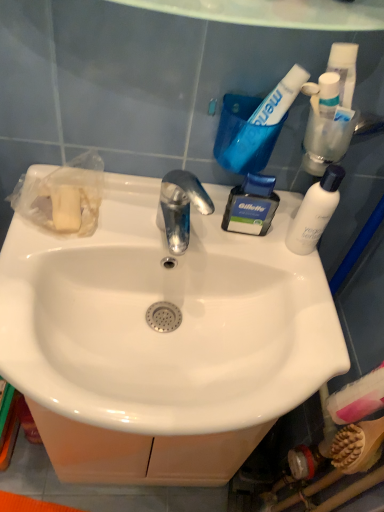
This screenshot has width=384, height=512. I want to click on blue plastic shaving cream at upper right, arranged as the 2th toiletry when ordered from the bottom, so click(251, 206).

The width and height of the screenshot is (384, 512). What are the coordinates of `clear plastic tube at upper right, placed as the first toiletry when sorted from top to bottom` in the screenshot? It's located at (325, 125).

Locate an element on the screen. white matte bottle at upper right is located at coordinates (315, 212).

In the scene shown: From the image's perspective, which is below, clear plastic tube at upper right, placed as the first toiletry when sorted from top to bottom, or white glossy sink at center?

From the image's view, white glossy sink at center is below.

Is clear plastic tube at upper right, placed as the first toiletry when sorted from top to bottom, facing towards white glossy sink at center?

No.

Who is shorter, clear plastic tube at upper right, which is the third toiletry in bottom-to-top order, or white glossy sink at center?

clear plastic tube at upper right, which is the third toiletry in bottom-to-top order.

Considering the relative positions of wooden bristles brush at lower right and blue plastic shaving cream at upper right, which is the third toiletry from right to left, in the image provided, is wooden bristles brush at lower right to the right of blue plastic shaving cream at upper right, which is the third toiletry from right to left, from the viewer's perspective?

Yes, wooden bristles brush at lower right is to the right of blue plastic shaving cream at upper right, which is the third toiletry from right to left.

You are a GUI agent. You are given a task and a screenshot of the screen. Output one action in this format:
    pyautogui.click(x=<x>, y=<y>)
    Task: Click on the brush that is under the blue plastic shaving cream at upper right, the first toiletry from the left (from a real-world perspective)
    The image size is (384, 512).
    Given the screenshot: What is the action you would take?
    pyautogui.click(x=358, y=446)

From a real-world perspective, which is physically above, wooden bristles brush at lower right or blue plastic shaving cream at upper right, marked as the second toiletry in a top-to-bottom arrangement?

blue plastic shaving cream at upper right, marked as the second toiletry in a top-to-bottom arrangement, is physically above.

Considering their positions, is wooden bristles brush at lower right located in front of or behind blue plastic shaving cream at upper right, which is the third toiletry from right to left?

wooden bristles brush at lower right is positioned closer to the viewer than blue plastic shaving cream at upper right, which is the third toiletry from right to left.

Who is more distant, white glossy sink at center or wooden bristles brush at lower right?

wooden bristles brush at lower right is further from the camera.

From a real-world perspective, which object rests below the other?

wooden bristles brush at lower right.

In order to click on sink located above the wooden bristles brush at lower right (from a real-world perspective) in this screenshot , I will do `click(165, 330)`.

Is white glossy sink at center next to wooden bristles brush at lower right?

No, white glossy sink at center is not with wooden bristles brush at lower right.

Based on the photo, from a real-world perspective, is white glossy sink at center positioned under clear plastic tube at upper right, the second toiletry in the left-to-right sequence, based on gravity?

Yes, from a real-world perspective, white glossy sink at center is beneath clear plastic tube at upper right, the second toiletry in the left-to-right sequence.

How different are the orientations of white glossy sink at center and clear plastic tube at upper right, placed as the first toiletry when sorted from top to bottom, in degrees?

0.708 degrees separate the facing orientations of white glossy sink at center and clear plastic tube at upper right, placed as the first toiletry when sorted from top to bottom.

Between white glossy sink at center and clear plastic tube at upper right, which is the third toiletry in bottom-to-top order, which one appears on the right side from the viewer's perspective?

Positioned to the right is clear plastic tube at upper right, which is the third toiletry in bottom-to-top order.

Find the location of a particular element. This screenshot has height=512, width=384. sink lying in front of the clear plastic tube at upper right, the second toiletry in the left-to-right sequence is located at coordinates (165, 330).

Is point (383, 364) positioned in front of point (140, 395)?

No, it is not.

From a real-world perspective, who is located higher, pink matte toothbrush at lower right, the 3th toiletry from the left, or white glossy sink at center?

white glossy sink at center is physically above.

Which of these two, pink matte toothbrush at lower right, the 3th toiletry from the left, or white glossy sink at center, is smaller?

Smaller between the two is pink matte toothbrush at lower right, the 3th toiletry from the left.

Where is `sink in front of the pink matte toothbrush at lower right, marked as the first toiletry in a bottom-to-top arrangement`? The height and width of the screenshot is (512, 384). sink in front of the pink matte toothbrush at lower right, marked as the first toiletry in a bottom-to-top arrangement is located at coordinates (165, 330).

From a real-world perspective, is clear plastic tube at upper right, marked as the 2th toiletry in a right-to-left arrangement, physically located above or below white glossy toothpaste at upper right?

clear plastic tube at upper right, marked as the 2th toiletry in a right-to-left arrangement, is above white glossy toothpaste at upper right.

Is clear plastic tube at upper right, placed as the first toiletry when sorted from top to bottom, spatially inside white glossy toothpaste at upper right, or outside of it?

clear plastic tube at upper right, placed as the first toiletry when sorted from top to bottom, exists outside the volume of white glossy toothpaste at upper right.

Considering their positions, is white glossy toothpaste at upper right located in front of or behind blue plastic shaving cream at upper right, the first toiletry from the left?

Clearly, white glossy toothpaste at upper right is in front of blue plastic shaving cream at upper right, the first toiletry from the left.

From a real-world perspective, is white glossy toothpaste at upper right positioned under blue plastic shaving cream at upper right, marked as the second toiletry in a top-to-bottom arrangement, based on gravity?

No, from a real-world perspective, white glossy toothpaste at upper right is not below blue plastic shaving cream at upper right, marked as the second toiletry in a top-to-bottom arrangement.

Is white glossy toothpaste at upper right oriented away from blue plastic shaving cream at upper right, which is the third toiletry from right to left?

No, white glossy toothpaste at upper right is not facing the opposite direction of blue plastic shaving cream at upper right, which is the third toiletry from right to left.

Does point (302, 80) come closer to viewer compared to point (262, 230)?

Yes, point (302, 80) is in front of point (262, 230).

What are the coordinates of `the 1st toiletry behind the white glossy sink at center, counting from the anchor's position` in the screenshot? It's located at (325, 125).

From a real-world perspective, which toiletry is the 2nd one above the wooden bristles brush at lower right? Please provide its 2D coordinates.

[(251, 206)]

Which object lies nearer to the anchor point wooden bristles brush at lower right, clear plastic tube at upper right, marked as the 2th toiletry in a right-to-left arrangement, or pink matte toothbrush at lower right, marked as the first toiletry in a bottom-to-top arrangement?

pink matte toothbrush at lower right, marked as the first toiletry in a bottom-to-top arrangement, lies closer to wooden bristles brush at lower right than the other object.

Based on the photo, considering their positions, is white glossy sink at center positioned closer to white matte bottle at upper right than pink matte toothbrush at lower right, marked as the third toiletry in a top-to-bottom arrangement?

Based on the image, white glossy sink at center appears to be nearer to white matte bottle at upper right.

Estimate the real-world distances between objects in this image. Which object is closer to white glossy toothpaste at upper right, clear plastic tube at upper right, the second toiletry in the left-to-right sequence, or pink matte toothbrush at lower right, the first toiletry viewed from the right?

clear plastic tube at upper right, the second toiletry in the left-to-right sequence, is positioned closer to the anchor white glossy toothpaste at upper right.

Considering their positions, is pink matte toothbrush at lower right, the 3th toiletry from the left, positioned further to white glossy toothpaste at upper right than white matte bottle at upper right?

The object further to white glossy toothpaste at upper right is pink matte toothbrush at lower right, the 3th toiletry from the left.

When comparing their distances from pink matte toothbrush at lower right, the first toiletry viewed from the right, does clear plastic tube at upper right, marked as the 2th toiletry in a right-to-left arrangement, or blue plastic shaving cream at upper right, arranged as the 2th toiletry when ordered from the bottom, seem closer?

blue plastic shaving cream at upper right, arranged as the 2th toiletry when ordered from the bottom, is positioned closer to the anchor pink matte toothbrush at lower right, the first toiletry viewed from the right.

In the scene shown: Estimate the real-world distances between objects in this image. Which object is further from pink matte toothbrush at lower right, the first toiletry viewed from the right, blue plastic shaving cream at upper right, marked as the second toiletry in a top-to-bottom arrangement, or white matte bottle at upper right?

Among the two, blue plastic shaving cream at upper right, marked as the second toiletry in a top-to-bottom arrangement, is located further to pink matte toothbrush at lower right, the first toiletry viewed from the right.

From the picture: Considering their positions, is blue plastic shaving cream at upper right, arranged as the 2th toiletry when ordered from the bottom, positioned further to wooden bristles brush at lower right than pink matte toothbrush at lower right, the 3th toiletry from the left?

blue plastic shaving cream at upper right, arranged as the 2th toiletry when ordered from the bottom, lies further to wooden bristles brush at lower right than the other object.

Estimate the real-world distances between objects in this image. Which object is further from white glossy sink at center, wooden bristles brush at lower right or clear plastic tube at upper right, the second toiletry in the left-to-right sequence?

The object further to white glossy sink at center is wooden bristles brush at lower right.

Find the location of a particular element. sink between clear plastic tube at upper right, which is the third toiletry in bottom-to-top order, and wooden bristles brush at lower right vertically is located at coordinates pyautogui.click(x=165, y=330).

The width and height of the screenshot is (384, 512). I want to click on toiletry that lies between clear plastic tube at upper right, placed as the first toiletry when sorted from top to bottom, and white glossy sink at center from top to bottom, so click(x=251, y=206).

Locate an element on the screen. This screenshot has width=384, height=512. brush located between white glossy sink at center and pink matte toothbrush at lower right, marked as the first toiletry in a bottom-to-top arrangement, in the left-right direction is located at coordinates (358, 446).

Locate an element on the screen. Image resolution: width=384 pixels, height=512 pixels. bottle between clear plastic tube at upper right, placed as the first toiletry when sorted from top to bottom, and pink matte toothbrush at lower right, marked as the third toiletry in a top-to-bottom arrangement, in the vertical direction is located at coordinates (315, 212).